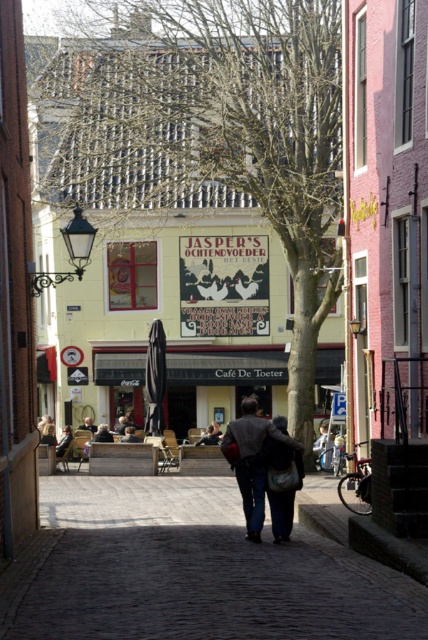
You are standing on the dark cobblestone pavement at center and want to step down to the dark gray suit at center. Is the pavement above or below the suit?

The dark cobblestone pavement at center is above the dark gray suit at center, so you would need to step down from the pavement to reach the suit.

You are a tailor who needs to determine which garment takes up more horizontal space in the image. You see a dark gray fabric coat at center and a dark gray suit at center. Which one is wider?

The dark gray fabric coat at center is wider than the dark gray suit at center according to the description.